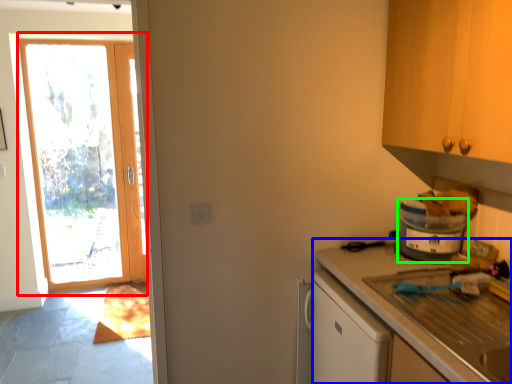
Question: Estimate the real-world distances between objects in this image. Which object is closer to door (highlighted by a red box), countertop (highlighted by a blue box) or appliance (highlighted by a green box)?

Choices:
 (A) countertop
 (B) appliance

Answer: (A)